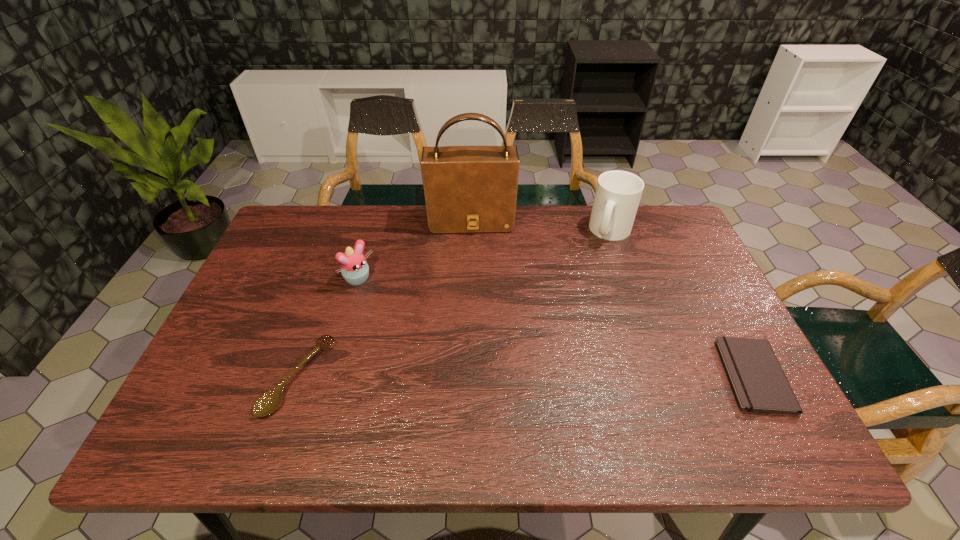
Locate an element on the screen. This screenshot has height=540, width=960. the fourth tallest object is located at coordinates [x=267, y=403].

Identify the location of checkbook. (759, 384).

Identify the location of the rightmost object. This screenshot has width=960, height=540. (759, 384).

Locate an element on the screen. the fourth shortest object is located at coordinates (618, 193).

This screenshot has width=960, height=540. Find the location of `mug`. mug is located at coordinates (618, 193).

Where is `the third farthest object`? The height and width of the screenshot is (540, 960). the third farthest object is located at coordinates (354, 268).

The height and width of the screenshot is (540, 960). I want to click on the third shortest object, so click(354, 268).

Identify the location of shoulder bag. This screenshot has height=540, width=960. (468, 189).

The image size is (960, 540). I want to click on the third object from right to left, so click(468, 189).

Identify the location of vacant space located 0.300m on the right of the fourth tallest object. (456, 377).